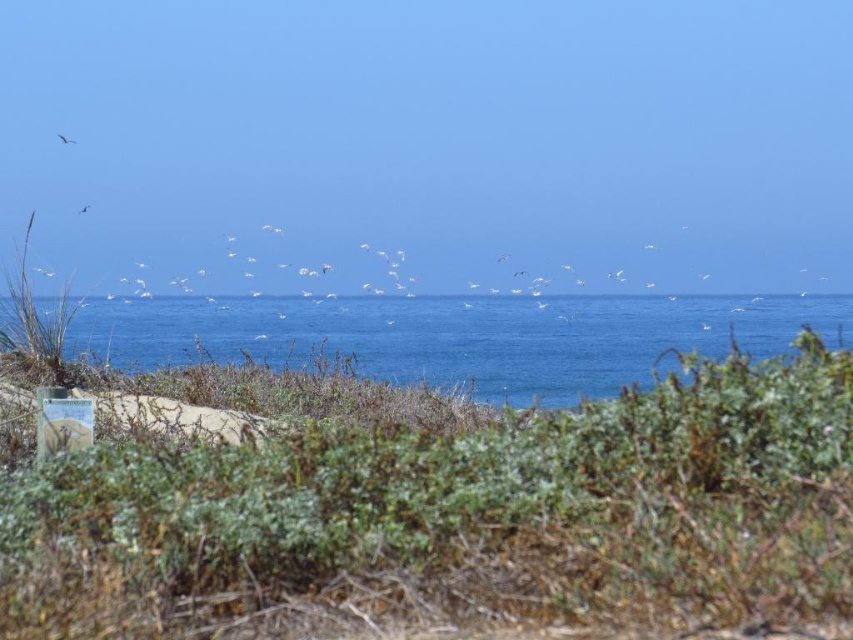
Question: Considering the relative positions of green shrubbery at center and white feathered bird at upper center in the image provided, where is green shrubbery at center located with respect to white feathered bird at upper center?

Choices:
 (A) below
 (B) above

Answer: (A)

Question: Considering the relative positions of green shrubbery at center and blue water at center in the image provided, where is green shrubbery at center located with respect to blue water at center?

Choices:
 (A) right
 (B) left

Answer: (B)

Question: Which of these objects is positioned closest to the blue water at center?

Choices:
 (A) white feathered bird at upper center
 (B) green shrubbery at center

Answer: (B)

Question: Which of the following is the farthest from the observer?

Choices:
 (A) (67, 144)
 (B) (88, 205)
 (C) (408, 324)
 (D) (815, 392)

Answer: (B)

Question: Which object is positioned closest to the blue water at center?

Choices:
 (A) white feathered bird at upper left
 (B) green shrubbery at center

Answer: (B)

Question: Can you confirm if green shrubbery at center is bigger than blue water at center?

Choices:
 (A) yes
 (B) no

Answer: (B)